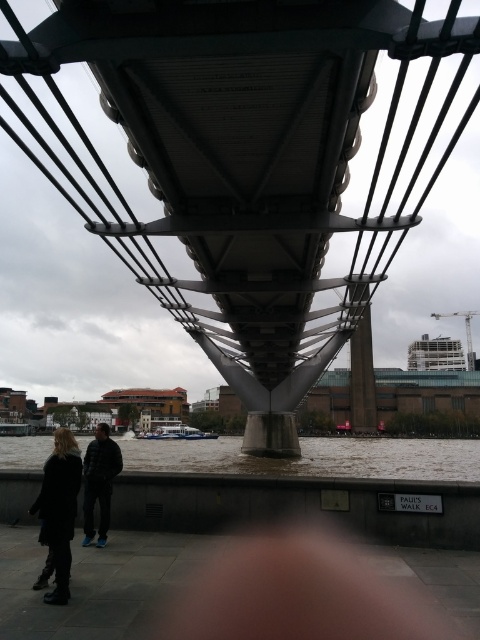
Looking at this image, does brown water at lower center have a larger size compared to dark gray jacket at lower left?

A: Indeed, brown water at lower center has a larger size compared to dark gray jacket at lower left.

Identify the location of brown water at lower center. This screenshot has width=480, height=640. (312, 458).

Does metallic gray suspension bridge at center have a lesser width compared to brown water at lower center?

Yes.

Is point (152, 291) positioned in front of point (16, 467)?

Yes, point (152, 291) is in front of point (16, 467).

Does point (394, 214) lie in front of point (305, 467)?

Yes, point (394, 214) is closer to viewer.

Where is `metallic gray suspension bridge at center`? This screenshot has height=640, width=480. metallic gray suspension bridge at center is located at coordinates (245, 163).

Which of these two, metallic gray suspension bridge at center or dark gray jacket at lower left, stands shorter?

dark gray jacket at lower left is shorter.

Where is `metallic gray suspension bridge at center`? Image resolution: width=480 pixels, height=640 pixels. metallic gray suspension bridge at center is located at coordinates (245, 163).

Does point (344, 52) come farther from viewer compared to point (104, 449)?

Yes.

Locate an element on the screen. The image size is (480, 640). metallic gray suspension bridge at center is located at coordinates (245, 163).